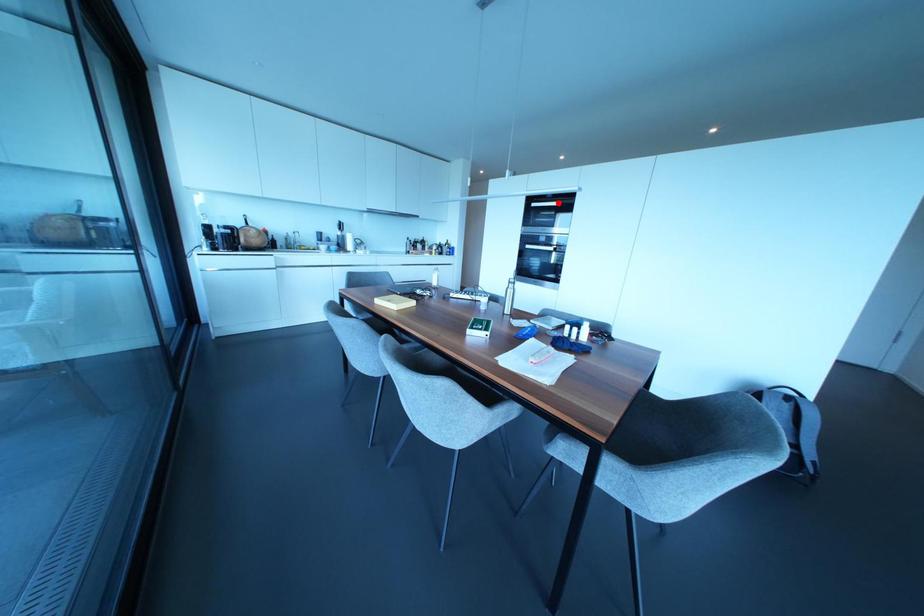
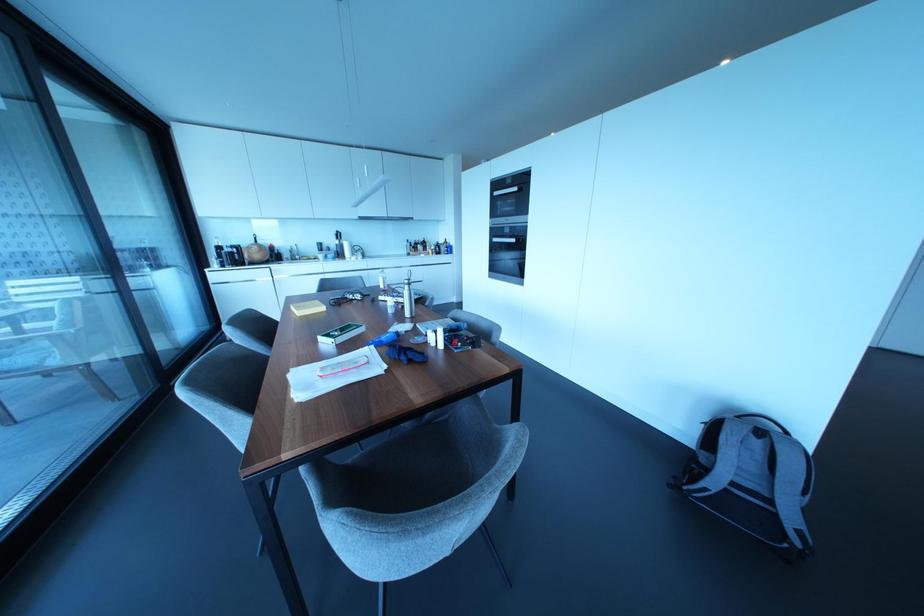
Locate, in the second image, the point that corresponds to the highlighted location in the first image.

(515, 188)